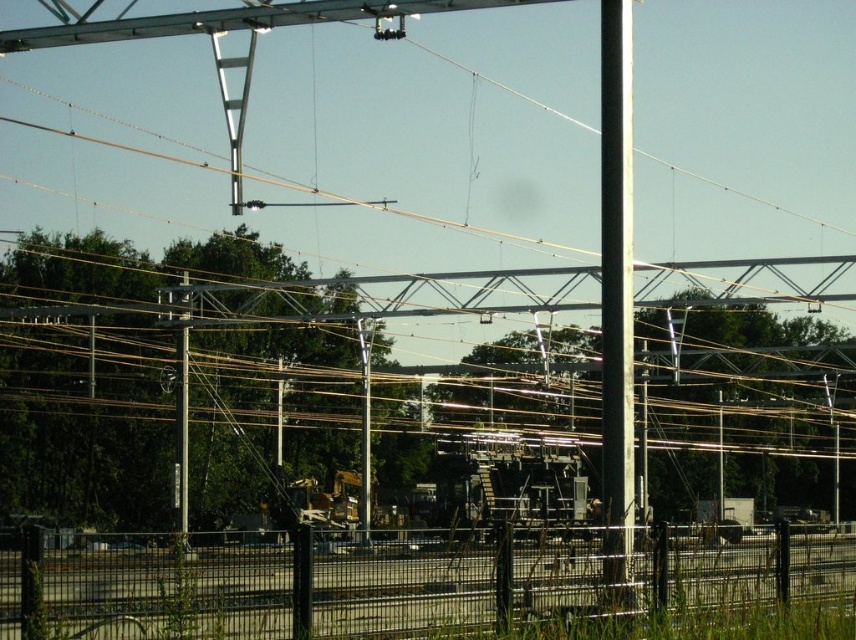
You are a maintenance worker who needs to reach the top of the white glossy pole at center and the metallic gray pole at center. Which pole will require you to climb higher?

The white glossy pole at center is much taller than the metallic gray pole at center, so you will need to climb higher to reach the top of the white glossy pole at center.

You are a maintenance worker needing to access the metallic gray pole at left and the metallic gray pole at center. Based on their positions, which pole would you approach first if you want to reach the one that is closer to your current position?

The metallic gray pole at left is in front of the metallic gray pole at center, so it is closer to you. Therefore, you should approach the metallic gray pole at left first since it is nearer to your current position.